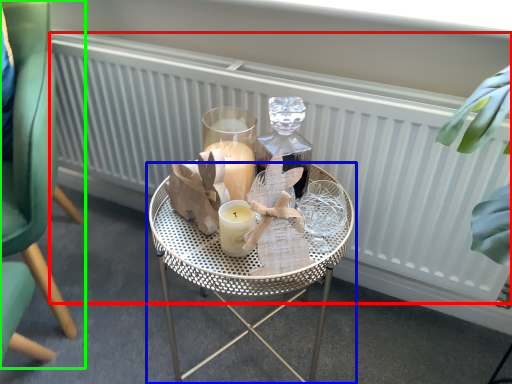
Question: Which is farther away from radiator (highlighted by a red box)? table (highlighted by a blue box) or chair (highlighted by a green box)?

Choices:
 (A) table
 (B) chair

Answer: (B)